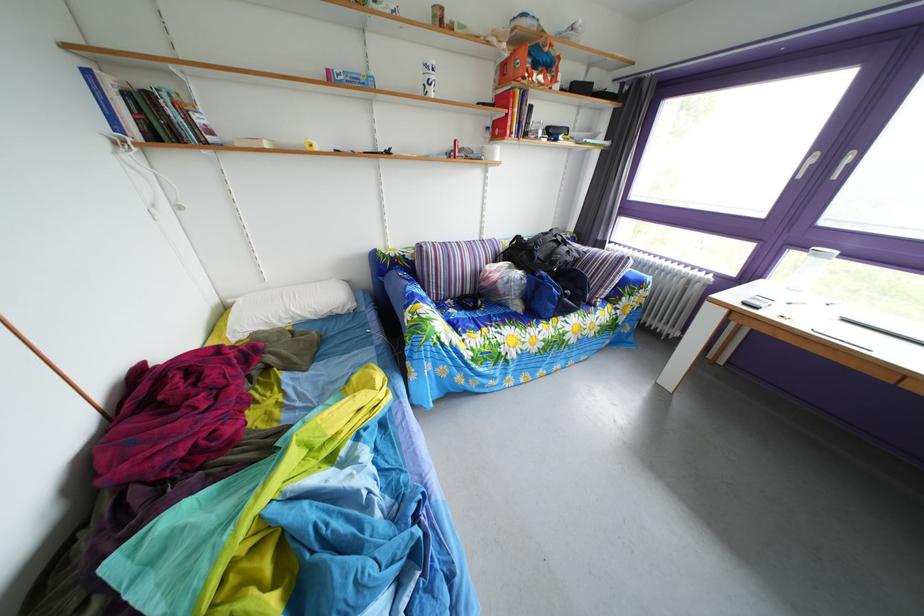
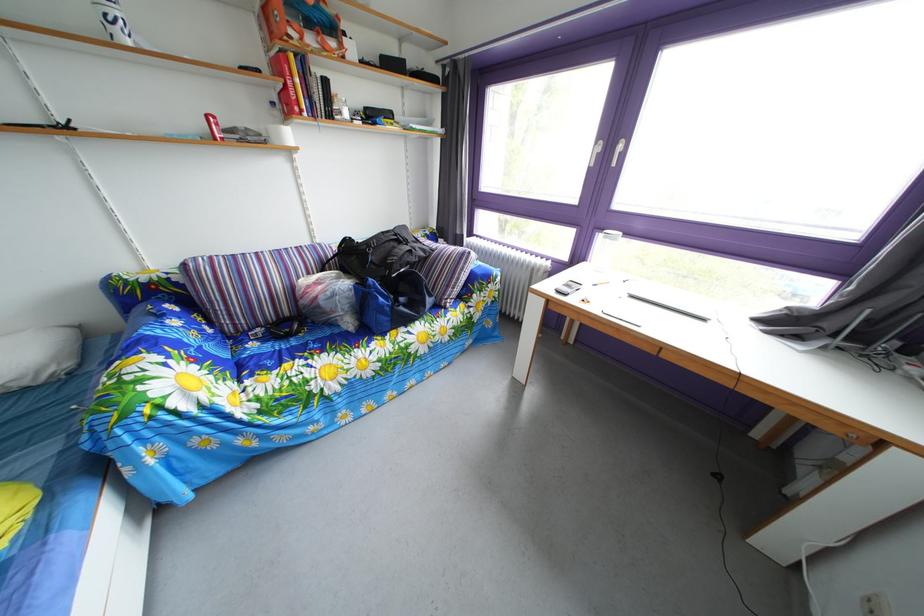
Where in the second image is the point corresponding to (833,167) from the first image?

(616, 156)